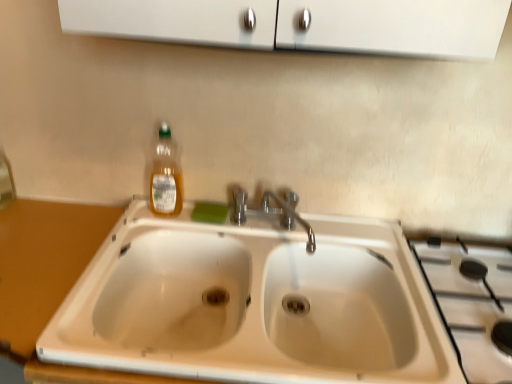
Question: Can you confirm if translucent plastic bottle at upper left is positioned to the right of white ceramic sink at center?

Choices:
 (A) no
 (B) yes

Answer: (A)

Question: Is white ceramic sink at center a part of translucent plastic bottle at upper left?

Choices:
 (A) yes
 (B) no

Answer: (B)

Question: Is translucent plastic bottle at upper left placed right next to white ceramic sink at center?

Choices:
 (A) yes
 (B) no

Answer: (B)

Question: From a real-world perspective, is translucent plastic bottle at upper left physically above white ceramic sink at center?

Choices:
 (A) no
 (B) yes

Answer: (B)

Question: From the image's perspective, would you say translucent plastic bottle at upper left is shown under white ceramic sink at center?

Choices:
 (A) no
 (B) yes

Answer: (A)

Question: From the image's perspective, relative to white ceramic gas stove at right, is translucent plastic bottle at upper left above or below?

Choices:
 (A) above
 (B) below

Answer: (A)

Question: Considering their positions, is translucent plastic bottle at upper left located in front of or behind white ceramic gas stove at right?

Choices:
 (A) front
 (B) behind

Answer: (B)

Question: Is translucent plastic bottle at upper left taller or shorter than white ceramic gas stove at right?

Choices:
 (A) tall
 (B) short

Answer: (A)

Question: Considering the positions of translucent plastic bottle at upper left and white ceramic gas stove at right in the image, is translucent plastic bottle at upper left bigger or smaller than white ceramic gas stove at right?

Choices:
 (A) big
 (B) small

Answer: (B)

Question: From the image's perspective, is translucent plastic bottle at upper left located above or below wooden counter at lower left?

Choices:
 (A) above
 (B) below

Answer: (A)

Question: From their relative heights in the image, would you say translucent plastic bottle at upper left is taller or shorter than wooden counter at lower left?

Choices:
 (A) tall
 (B) short

Answer: (B)

Question: Considering the positions of point (162, 165) and point (22, 339), is point (162, 165) closer or farther from the camera than point (22, 339)?

Choices:
 (A) closer
 (B) farther

Answer: (B)

Question: In terms of size, does translucent plastic bottle at upper left appear bigger or smaller than wooden counter at lower left?

Choices:
 (A) big
 (B) small

Answer: (B)

Question: From a real-world perspective, is white ceramic gas stove at right physically located above or below white ceramic sink at center?

Choices:
 (A) above
 (B) below

Answer: (A)

Question: Considering the positions of white ceramic gas stove at right and white ceramic sink at center in the image, is white ceramic gas stove at right wider or thinner than white ceramic sink at center?

Choices:
 (A) wide
 (B) thin

Answer: (B)